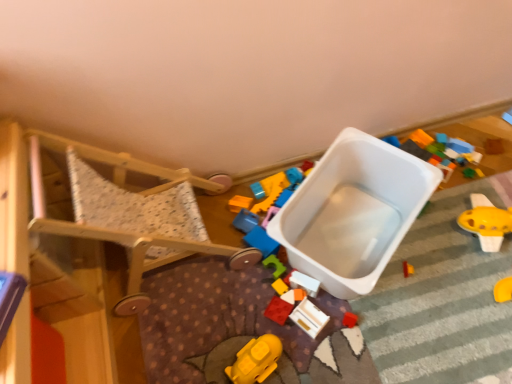
Question: From a real-world perspective, is yellow plastic toy at right, placed as the 6th toy when sorted from left to right, on top of yellow matte toy at lower center, which is counted as the first toy, starting from the left?

Choices:
 (A) no
 (B) yes

Answer: (A)

Question: Is yellow plastic toy at right, which is counted as the first toy, starting from the right, positioned beyond the bounds of yellow matte toy at lower center, placed as the 6th toy when sorted from right to left?

Choices:
 (A) yes
 (B) no

Answer: (A)

Question: Is yellow plastic toy at right, which is counted as the first toy, starting from the right, next to yellow matte toy at lower center, placed as the 6th toy when sorted from right to left, and touching it?

Choices:
 (A) no
 (B) yes

Answer: (A)

Question: Considering the relative positions of yellow plastic toy at right, placed as the 6th toy when sorted from left to right, and yellow matte toy at lower center, which is counted as the first toy, starting from the left, in the image provided, is yellow plastic toy at right, placed as the 6th toy when sorted from left to right, in front of yellow matte toy at lower center, which is counted as the first toy, starting from the left,?

Choices:
 (A) no
 (B) yes

Answer: (A)

Question: Can you confirm if yellow plastic toy at right, placed as the 6th toy when sorted from left to right, is shorter than yellow matte toy at lower center, placed as the 6th toy when sorted from right to left?

Choices:
 (A) no
 (B) yes

Answer: (A)

Question: Would you say rubberized red block at center, which appears as the fifth toy when viewed from the right, is inside or outside wooden walker at left?

Choices:
 (A) inside
 (B) outside

Answer: (B)

Question: From a real-world perspective, is rubberized red block at center, which appears as the fifth toy when viewed from the right, physically located above or below wooden walker at left?

Choices:
 (A) below
 (B) above

Answer: (A)

Question: From the image's perspective, relative to wooden walker at left, is rubberized red block at center, which appears as the fifth toy when viewed from the right, above or below?

Choices:
 (A) above
 (B) below

Answer: (B)

Question: Considering the positions of rubberized red block at center, which appears as the fifth toy when viewed from the right, and wooden walker at left in the image, is rubberized red block at center, which appears as the fifth toy when viewed from the right, bigger or smaller than wooden walker at left?

Choices:
 (A) big
 (B) small

Answer: (B)

Question: Considering the positions of yellow plastic toy at right, placed as the 6th toy when sorted from left to right, and wooden toy at center, the second toy in the right-to-left sequence, in the image, is yellow plastic toy at right, placed as the 6th toy when sorted from left to right, bigger or smaller than wooden toy at center, the second toy in the right-to-left sequence,?

Choices:
 (A) small
 (B) big

Answer: (B)

Question: Does point (494, 206) appear closer or farther from the camera than point (305, 319)?

Choices:
 (A) farther
 (B) closer

Answer: (A)

Question: From the image's perspective, is yellow plastic toy at right, placed as the 6th toy when sorted from left to right, located above or below wooden toy at center, which appears as the fifth toy when viewed from the left?

Choices:
 (A) below
 (B) above

Answer: (B)

Question: Is yellow plastic toy at right, which is counted as the first toy, starting from the right, taller or shorter than wooden toy at center, which appears as the fifth toy when viewed from the left?

Choices:
 (A) short
 (B) tall

Answer: (B)

Question: Is wooden toy at center, which appears as the fifth toy when viewed from the left, taller or shorter than white plastic toy at center, which ranks as the fourth toy in left-to-right order?

Choices:
 (A) short
 (B) tall

Answer: (A)

Question: Would you say wooden toy at center, the second toy in the right-to-left sequence, is inside or outside white plastic toy at center, which ranks as the fourth toy in left-to-right order?

Choices:
 (A) outside
 (B) inside

Answer: (A)